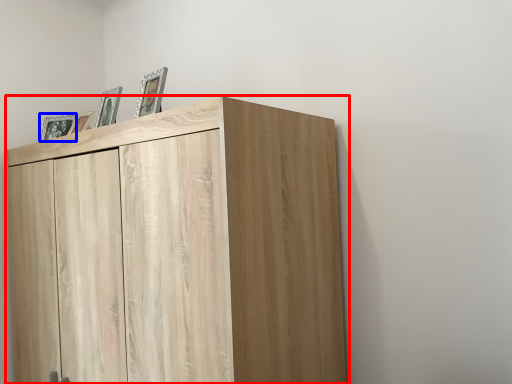
Question: Which object appears closest to the camera in this image, cupboard (highlighted by a red box) or picture frame (highlighted by a blue box)?

Choices:
 (A) cupboard
 (B) picture frame

Answer: (A)